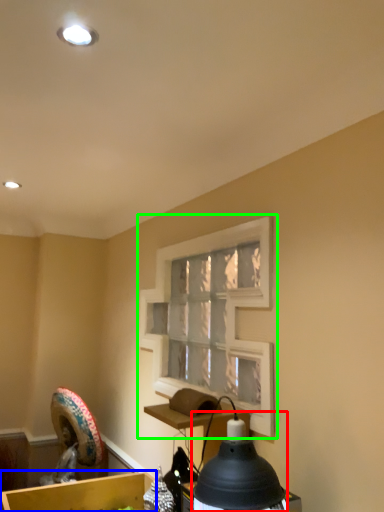
Question: Which is nearer to the lamp (highlighted by a red box)? cardboard box (highlighted by a blue box) or window frame (highlighted by a green box).

Choices:
 (A) cardboard box
 (B) window frame

Answer: (B)